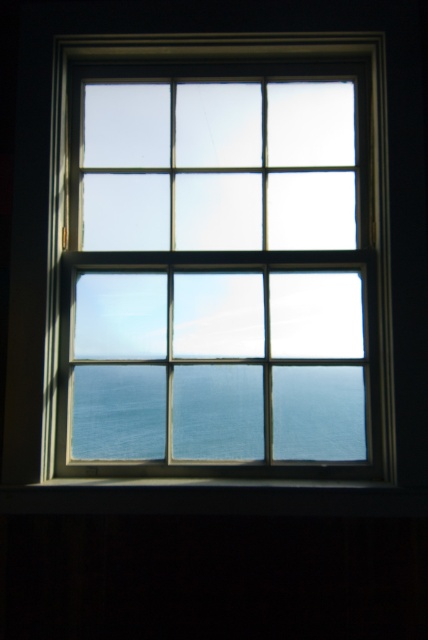
Question: Is clear glass window at center thinner than dark wood paneling at bottom?

Choices:
 (A) yes
 (B) no

Answer: (A)

Question: Among these objects, which one is nearest to the camera?

Choices:
 (A) dark wood paneling at bottom
 (B) clear glass window at center

Answer: (A)

Question: Among these points, which one is farthest from the camera?

Choices:
 (A) (211, 120)
 (B) (172, 576)

Answer: (A)

Question: Is clear glass window at center to the left of dark wood paneling at bottom from the viewer's perspective?

Choices:
 (A) no
 (B) yes

Answer: (A)

Question: Based on their relative distances, which object is farther from the dark wood paneling at bottom?

Choices:
 (A) blue glassy water at center
 (B) clear glass window at center

Answer: (B)

Question: Does clear glass window at center have a larger size compared to dark wood paneling at bottom?

Choices:
 (A) no
 (B) yes

Answer: (B)